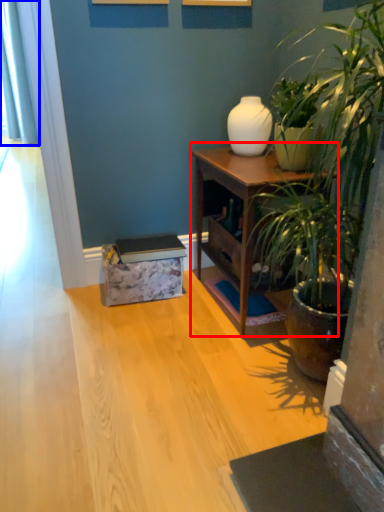
Question: Which object appears farthest to the camera in this image, nightstand (highlighted by a red box) or curtain (highlighted by a blue box)?

Choices:
 (A) nightstand
 (B) curtain

Answer: (B)